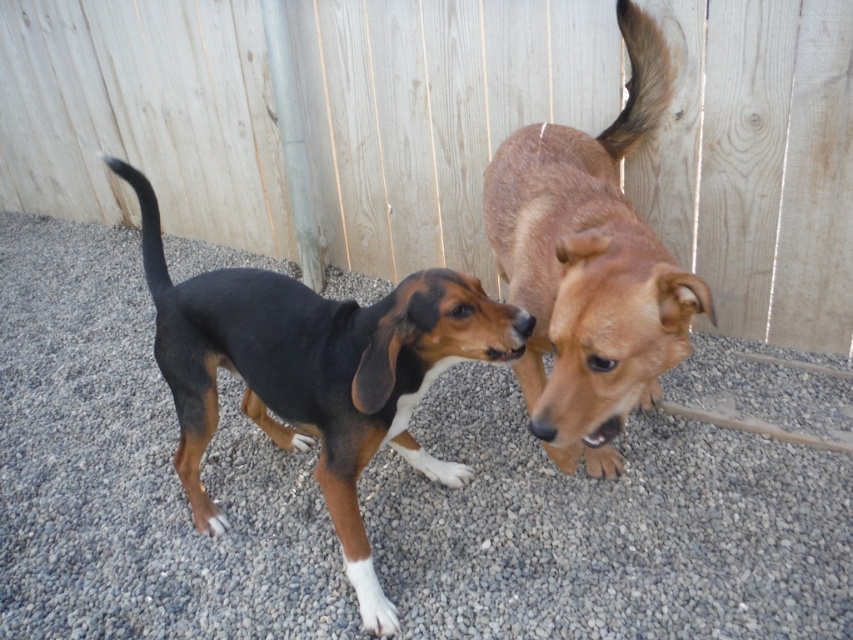
Question: Estimate the real-world distances between objects in this image. Which object is farther from the gray gravel at center?

Choices:
 (A) wooden fence at upper center
 (B) black and brown fur dog at center
 (C) brown furry dog at upper right

Answer: (A)

Question: Is gray gravel at center smaller than black and brown fur dog at center?

Choices:
 (A) no
 (B) yes

Answer: (A)

Question: Does wooden fence at upper center appear over black and brown fur dog at center?

Choices:
 (A) no
 (B) yes

Answer: (B)

Question: Can you confirm if black and brown fur dog at center is bigger than brown furry dog at upper right?

Choices:
 (A) no
 (B) yes

Answer: (A)

Question: Which object is farther from the camera taking this photo?

Choices:
 (A) brown furry dog at upper right
 (B) wooden fence at upper center
 (C) black and brown fur dog at center
 (D) gray gravel at center

Answer: (B)

Question: Considering the real-world distances, which object is closest to the black and brown fur dog at center?

Choices:
 (A) gray gravel at center
 (B) wooden fence at upper center
 (C) brown furry dog at upper right

Answer: (C)